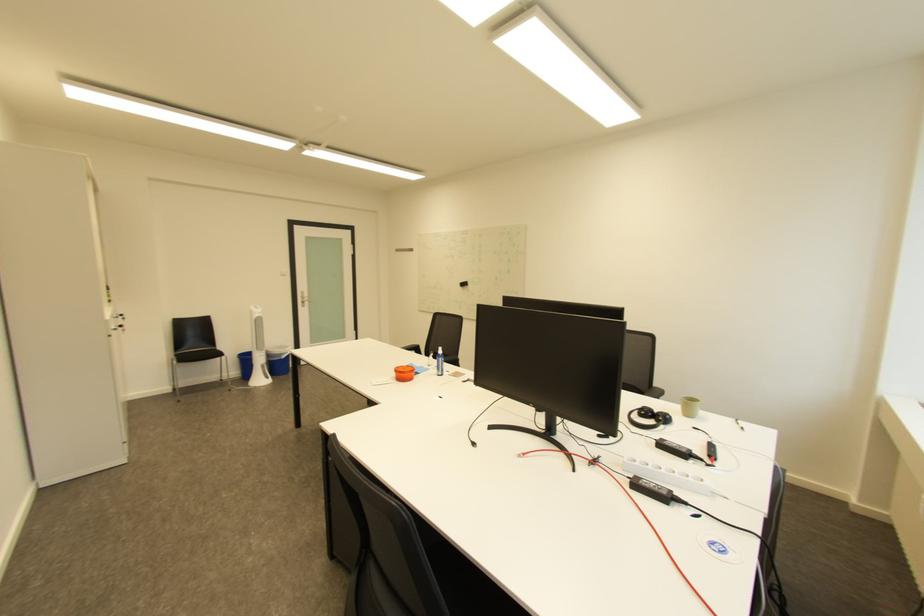
Describe the element at coordinates (116, 322) in the screenshot. This screenshot has width=924, height=616. I see `a cabinet handle` at that location.